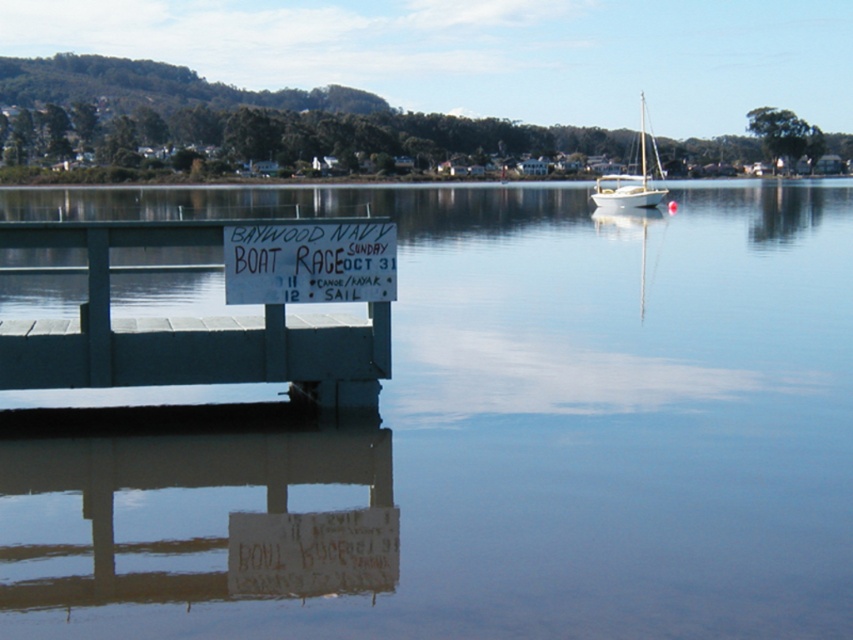
Question: Does white paper sign at center appear on the left side of white sailboat at upper right?

Choices:
 (A) yes
 (B) no

Answer: (A)

Question: Which of these objects is positioned closest to the clear water at center?

Choices:
 (A) teal painted wood dock at left
 (B) white sailboat at upper right

Answer: (A)

Question: Which point is closer to the camera taking this photo?

Choices:
 (A) (323, 282)
 (B) (614, 529)

Answer: (B)

Question: Considering the real-world distances, which object is closest to the white paper sign at center?

Choices:
 (A) white sailboat at upper right
 (B) teal painted wood dock at left
 (C) clear water at center

Answer: (B)

Question: Is clear water at center to the right of teal painted wood dock at left from the viewer's perspective?

Choices:
 (A) no
 (B) yes

Answer: (B)

Question: Is teal painted wood dock at left behind white paper sign at center?

Choices:
 (A) yes
 (B) no

Answer: (B)